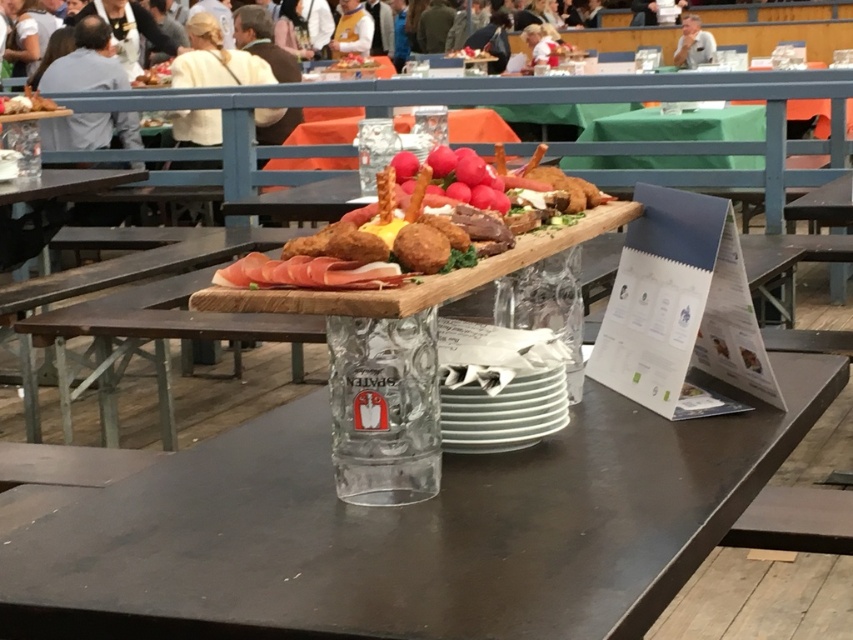
Can you confirm if transparent glass at center is bigger than golden fried croquettes at center?

Correct, transparent glass at center is larger in size than golden fried croquettes at center.

Which is behind, point (142, 627) or point (332, 196)?

Point (332, 196)

In order to click on transparent glass at center in this screenshot , I will do (407, 531).